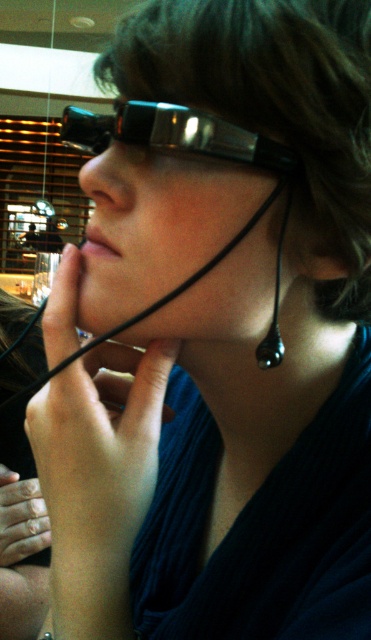
Question: Is black glossy glasses at center behind black glossy earring at lower right?

Choices:
 (A) yes
 (B) no

Answer: (B)

Question: Which object is closer to the camera taking this photo?

Choices:
 (A) black glossy glasses at center
 (B) black glossy earring at lower right

Answer: (A)

Question: Which point is farther to the camera?

Choices:
 (A) black glossy earring at lower right
 (B) black glossy glasses at center

Answer: (A)

Question: Which of the following is the farthest from the observer?

Choices:
 (A) black glossy earring at lower right
 (B) black glossy glasses at center

Answer: (A)

Question: Does black glossy glasses at center appear on the right side of black glossy earring at lower right?

Choices:
 (A) no
 (B) yes

Answer: (A)

Question: Is black glossy glasses at center below black glossy earring at lower right?

Choices:
 (A) yes
 (B) no

Answer: (B)